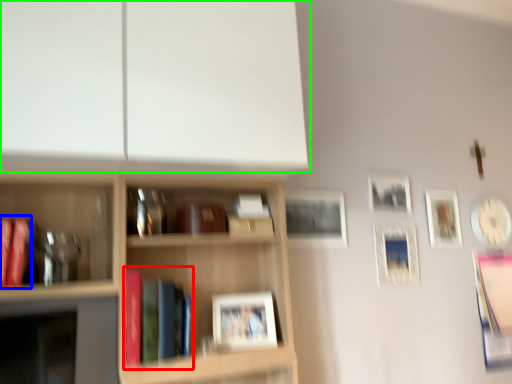
Question: Which object is the farthest from book (highlighted by a red box)? Choose among these: book (highlighted by a blue box) or shelf (highlighted by a green box).

Choices:
 (A) book
 (B) shelf

Answer: (B)